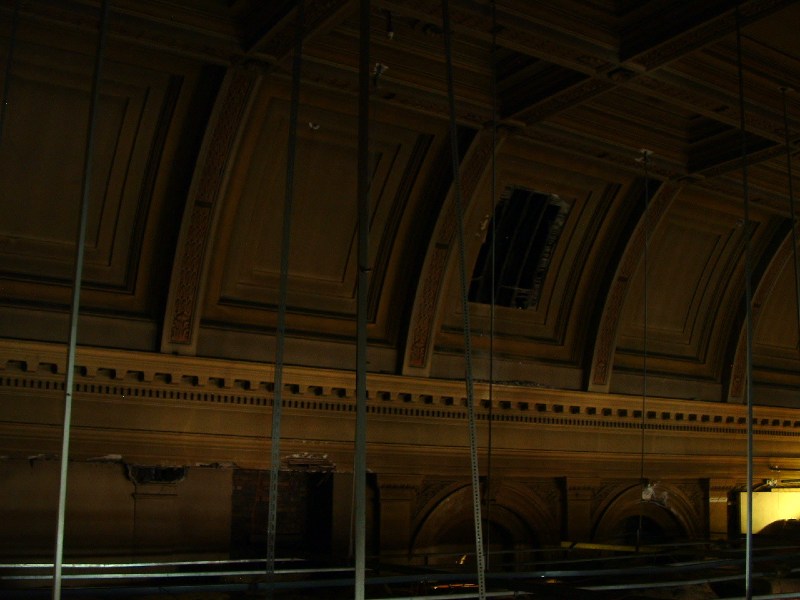
Image resolution: width=800 pixels, height=600 pixels. In order to click on arched window frames in this screenshot , I will do `click(513, 500)`, `click(628, 500)`.